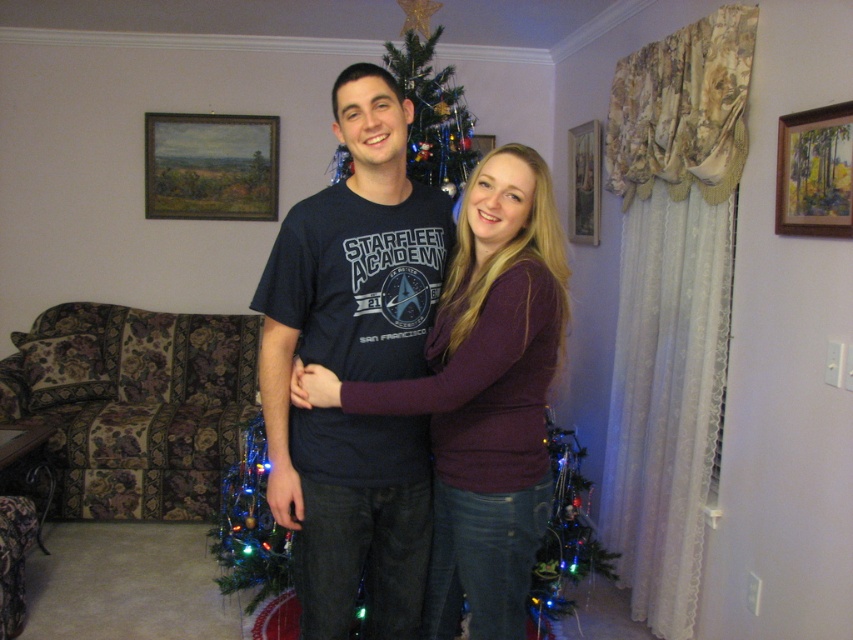
You are a photographer setting up a tripod to capture the wooden framed painting at upper right and the multicolored lights at lower left in the same shot. Given that your camera has a 50mm lens with a 46 degree angle of view, will you be able to fit both objects into the frame without moving the tripod?

The wooden framed painting at upper right and multicolored lights at lower left are 5.72 feet apart. To determine if they can fit in the frame, calculate the maximum distance between two points the lens can capture. With a 46 degree angle of view, the maximum distance would depend on the distance from the camera to the objects. However, since the separation between the objects is 5.72 feet, if the camera is positioned such that this distance falls within the 46 degree field of view, they can be captured. As